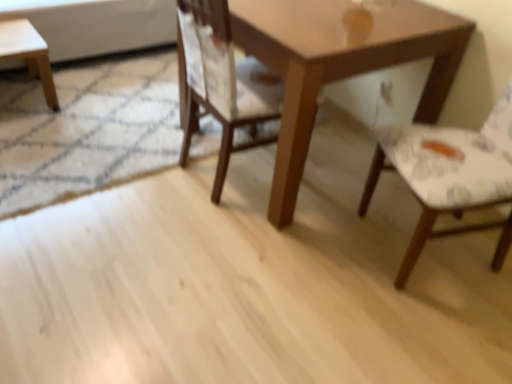
The width and height of the screenshot is (512, 384). What do you see at coordinates (28, 53) in the screenshot?
I see `light brown wooden stool at left` at bounding box center [28, 53].

This screenshot has height=384, width=512. Describe the element at coordinates (224, 84) in the screenshot. I see `wooden chair at center, the 1th chair in the left-to-right sequence` at that location.

Measure the distance between point (409, 174) and camera.

Point (409, 174) and camera are 4.71 feet apart from each other.

The width and height of the screenshot is (512, 384). In order to click on light brown wooden stool at left in this screenshot , I will do `click(28, 53)`.

Between wooden chair at center, acting as the second chair starting from the right, and white fabric chair at right, which appears as the first chair when viewed from the right, which one has larger size?

white fabric chair at right, which appears as the first chair when viewed from the right, is bigger.

Which object is more forward, wooden chair at center, the 1th chair in the left-to-right sequence, or white fabric chair at right, marked as the 2th chair in a left-to-right arrangement?

white fabric chair at right, marked as the 2th chair in a left-to-right arrangement, is more forward.

From the picture: Is the surface of wooden chair at center, acting as the second chair starting from the right, in direct contact with white fabric chair at right, marked as the 2th chair in a left-to-right arrangement?

wooden chair at center, acting as the second chair starting from the right, is not next to white fabric chair at right, marked as the 2th chair in a left-to-right arrangement, and they're not touching.

Can white fabric chair at right, marked as the 2th chair in a left-to-right arrangement, be found inside wooden chair at center, the 1th chair in the left-to-right sequence?

That's incorrect, white fabric chair at right, marked as the 2th chair in a left-to-right arrangement, is not inside wooden chair at center, the 1th chair in the left-to-right sequence.

How different are the orientations of light brown wooden stool at left and wooden table at center in degrees?

They differ by 89.7 degrees in their facing directions.

Based on their sizes in the image, would you say light brown wooden stool at left is bigger or smaller than wooden table at center?

Clearly, light brown wooden stool at left is smaller in size than wooden table at center.

From a real-world perspective, does light brown wooden stool at left sit lower than wooden table at center?

Indeed, from a real-world perspective, light brown wooden stool at left is positioned beneath wooden table at center.

Which object is wider, light brown wooden stool at left or wooden table at center?

With larger width is wooden table at center.

From the image's perspective, between white fabric chair at right, marked as the 2th chair in a left-to-right arrangement, and wooden chair at center, the 1th chair in the left-to-right sequence, which one is located above?

wooden chair at center, the 1th chair in the left-to-right sequence.

Does white fabric chair at right, which appears as the first chair when viewed from the right, have a lesser height compared to wooden chair at center, the 1th chair in the left-to-right sequence?

Incorrect, the height of white fabric chair at right, which appears as the first chair when viewed from the right, does not fall short of that of wooden chair at center, the 1th chair in the left-to-right sequence.

Is white fabric chair at right, marked as the 2th chair in a left-to-right arrangement, further to camera compared to wooden chair at center, the 1th chair in the left-to-right sequence?

No, white fabric chair at right, marked as the 2th chair in a left-to-right arrangement, is closer to the viewer.

Is white fabric chair at right, marked as the 2th chair in a left-to-right arrangement, bigger than wooden chair at center, acting as the second chair starting from the right?

Indeed, white fabric chair at right, marked as the 2th chair in a left-to-right arrangement, has a larger size compared to wooden chair at center, acting as the second chair starting from the right.

Could you tell me if wooden table at center is turned towards light brown wooden stool at left?

No, wooden table at center is not oriented towards light brown wooden stool at left.

The image size is (512, 384). I want to click on coffee table below the wooden table at center (from a real-world perspective), so click(x=28, y=53).

Looking at the image, does wooden table at center seem bigger or smaller compared to light brown wooden stool at left?

In the image, wooden table at center appears to be larger than light brown wooden stool at left.

Would you consider wooden table at center to be distant from light brown wooden stool at left?

wooden table at center is far away from light brown wooden stool at left.

Is wooden chair at center, the 1th chair in the left-to-right sequence, positioned beyond the bounds of wooden table at center?

Actually, wooden chair at center, the 1th chair in the left-to-right sequence, is at least partially inside wooden table at center.

Which is in front, wooden chair at center, the 1th chair in the left-to-right sequence, or wooden table at center?

Positioned in front is wooden chair at center, the 1th chair in the left-to-right sequence.

Locate an element on the screen. The height and width of the screenshot is (384, 512). table located on the right of wooden chair at center, the 1th chair in the left-to-right sequence is located at coordinates (337, 62).

Is wooden chair at center, the 1th chair in the left-to-right sequence, to the left or to the right of wooden table at center in the image?

Clearly, wooden chair at center, the 1th chair in the left-to-right sequence, is on the left of wooden table at center in the image.

Based on the photo, is light brown wooden stool at left oriented away from white fabric chair at right, marked as the 2th chair in a left-to-right arrangement?

No, white fabric chair at right, marked as the 2th chair in a left-to-right arrangement, is not at the back of light brown wooden stool at left.

Considering the relative positions of light brown wooden stool at left and white fabric chair at right, marked as the 2th chair in a left-to-right arrangement, in the image provided, is light brown wooden stool at left in front of white fabric chair at right, marked as the 2th chair in a left-to-right arrangement,?

No, light brown wooden stool at left is behind white fabric chair at right, marked as the 2th chair in a left-to-right arrangement.

From a real-world perspective, which object stands above the other?

white fabric chair at right, which appears as the first chair when viewed from the right, from a real-world perspective.

Where is `coffee table that appears below the white fabric chair at right, which appears as the first chair when viewed from the right (from a real-world perspective)`? This screenshot has height=384, width=512. coffee table that appears below the white fabric chair at right, which appears as the first chair when viewed from the right (from a real-world perspective) is located at coordinates (28, 53).

Based on the photo, is white fabric chair at right, marked as the 2th chair in a left-to-right arrangement, oriented away from light brown wooden stool at left?

white fabric chair at right, marked as the 2th chair in a left-to-right arrangement, does not have its back to light brown wooden stool at left.

From the image's perspective, would you say white fabric chair at right, which appears as the first chair when viewed from the right, is shown under light brown wooden stool at left?

Yes, from the image's perspective, white fabric chair at right, which appears as the first chair when viewed from the right, is beneath light brown wooden stool at left.

From a real-world perspective, is white fabric chair at right, marked as the 2th chair in a left-to-right arrangement, below light brown wooden stool at left?

No, from a real-world perspective, white fabric chair at right, marked as the 2th chair in a left-to-right arrangement, is not under light brown wooden stool at left.

Identify the location of chair that is behind the white fabric chair at right, marked as the 2th chair in a left-to-right arrangement. The height and width of the screenshot is (384, 512). pyautogui.click(x=224, y=84).

Identify the location of table positioned vertically above the light brown wooden stool at left (from a real-world perspective). This screenshot has width=512, height=384. (337, 62).

Which object lies nearer to the anchor point wooden chair at center, acting as the second chair starting from the right, wooden table at center or light brown wooden stool at left?

The object closer to wooden chair at center, acting as the second chair starting from the right, is wooden table at center.

Based on their spatial positions, is wooden table at center or wooden chair at center, acting as the second chair starting from the right, further from light brown wooden stool at left?

Among the two, wooden table at center is located further to light brown wooden stool at left.

Which object lies nearer to the anchor point wooden chair at center, acting as the second chair starting from the right, white fabric chair at right, marked as the 2th chair in a left-to-right arrangement, or light brown wooden stool at left?

Based on the image, white fabric chair at right, marked as the 2th chair in a left-to-right arrangement, appears to be nearer to wooden chair at center, acting as the second chair starting from the right.

In the scene shown: From the image, which object appears to be nearer to white fabric chair at right, which appears as the first chair when viewed from the right, wooden table at center or wooden chair at center, acting as the second chair starting from the right?

Among the two, wooden table at center is located nearer to white fabric chair at right, which appears as the first chair when viewed from the right.

Estimate the real-world distances between objects in this image. Which object is closer to wooden table at center, light brown wooden stool at left or white fabric chair at right, marked as the 2th chair in a left-to-right arrangement?

Among the two, white fabric chair at right, marked as the 2th chair in a left-to-right arrangement, is located nearer to wooden table at center.

Looking at the image, which one is located further to wooden table at center, white fabric chair at right, which appears as the first chair when viewed from the right, or light brown wooden stool at left?

light brown wooden stool at left lies further to wooden table at center than the other object.

Based on their spatial positions, is white fabric chair at right, marked as the 2th chair in a left-to-right arrangement, or wooden chair at center, acting as the second chair starting from the right, closer to wooden table at center?

wooden chair at center, acting as the second chair starting from the right, lies closer to wooden table at center than the other object.

From the image, which object appears to be nearer to light brown wooden stool at left, wooden chair at center, the 1th chair in the left-to-right sequence, or wooden table at center?

Among the two, wooden chair at center, the 1th chair in the left-to-right sequence, is located nearer to light brown wooden stool at left.

This screenshot has width=512, height=384. I want to click on chair between light brown wooden stool at left and white fabric chair at right, marked as the 2th chair in a left-to-right arrangement, from left to right, so (x=224, y=84).

At what (x,y) coordinates should I click in order to perform the action: click on table located between light brown wooden stool at left and white fabric chair at right, marked as the 2th chair in a left-to-right arrangement, in the left-right direction. Please return your answer as a coordinate pair (x, y). Looking at the image, I should click on pos(337,62).

You are a GUI agent. You are given a task and a screenshot of the screen. Output one action in this format:
    pyautogui.click(x=<x>, y=<y>)
    Task: Click on the chair between light brown wooden stool at left and wooden table at center in the horizontal direction
    
    Given the screenshot: What is the action you would take?
    pyautogui.click(x=224, y=84)

Locate an element on the screen. table located between wooden chair at center, acting as the second chair starting from the right, and white fabric chair at right, marked as the 2th chair in a left-to-right arrangement, in the left-right direction is located at coordinates (337, 62).